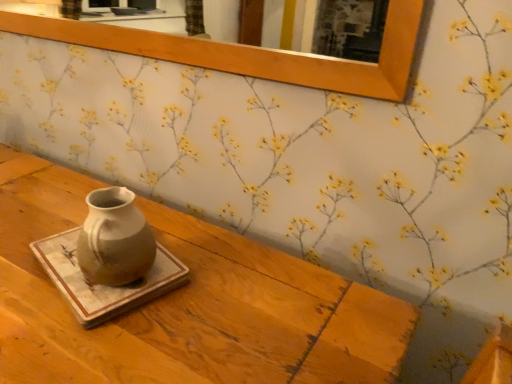
Question: Is matte ceramic vase at center at the back of wooden frame at upper center?

Choices:
 (A) no
 (B) yes

Answer: (A)

Question: Is the depth of wooden frame at upper center less than that of matte ceramic vase at center?

Choices:
 (A) no
 (B) yes

Answer: (A)

Question: Is wooden frame at upper center taller than matte ceramic vase at center?

Choices:
 (A) yes
 (B) no

Answer: (B)

Question: From the image's perspective, does wooden frame at upper center appear lower than matte ceramic vase at center?

Choices:
 (A) yes
 (B) no

Answer: (B)

Question: Considering the relative sizes of wooden frame at upper center and matte ceramic vase at center in the image provided, is wooden frame at upper center smaller than matte ceramic vase at center?

Choices:
 (A) yes
 (B) no

Answer: (A)

Question: From the image's perspective, is wooden frame at upper center over matte ceramic vase at center?

Choices:
 (A) no
 (B) yes

Answer: (B)

Question: Considering the relative positions of matte ceramic vase at center and wooden frame at upper center in the image provided, is matte ceramic vase at center in front of wooden frame at upper center?

Choices:
 (A) no
 (B) yes

Answer: (B)

Question: Is matte ceramic vase at center positioned far away from wooden frame at upper center?

Choices:
 (A) no
 (B) yes

Answer: (A)

Question: From a real-world perspective, does matte ceramic vase at center sit lower than wooden frame at upper center?

Choices:
 (A) no
 (B) yes

Answer: (B)

Question: Is wooden frame at upper center at the back of matte ceramic vase at center?

Choices:
 (A) yes
 (B) no

Answer: (B)

Question: Does matte ceramic vase at center have a larger size compared to wooden frame at upper center?

Choices:
 (A) yes
 (B) no

Answer: (A)

Question: Is matte ceramic vase at center located outside wooden frame at upper center?

Choices:
 (A) no
 (B) yes

Answer: (B)

Question: From a real-world perspective, does wooden frame at upper center stand above marble tray at center?

Choices:
 (A) no
 (B) yes

Answer: (B)